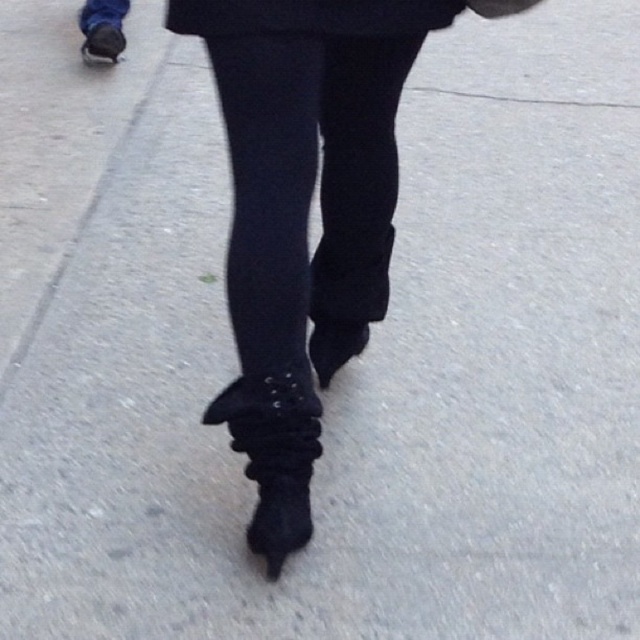
You are a fashion designer observing the scene. You notice the black suede boot at lower center and the black matte coat at upper center. Which item is located to the left of the other?

The black suede boot at lower center is positioned on the left side of black matte coat at upper center.